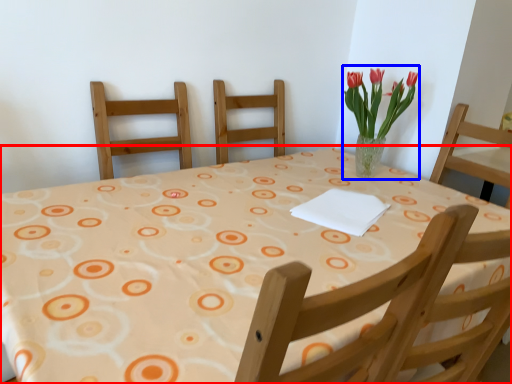
Question: Which point is closer to the camera, table (highlighted by a red box) or floral arrangement (highlighted by a blue box)?

Choices:
 (A) table
 (B) floral arrangement

Answer: (A)